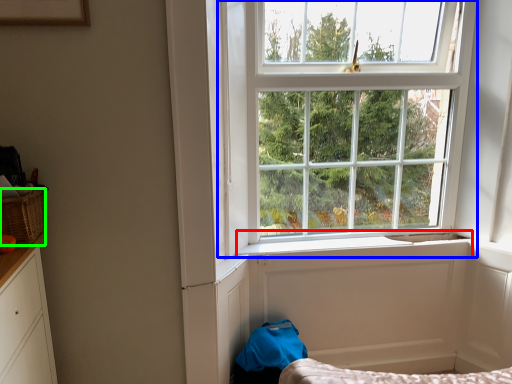
Question: Considering the real-world distances, which object is farthest from window sill (highlighted by a red box)? window (highlighted by a blue box) or basket (highlighted by a green box)?

Choices:
 (A) window
 (B) basket

Answer: (B)